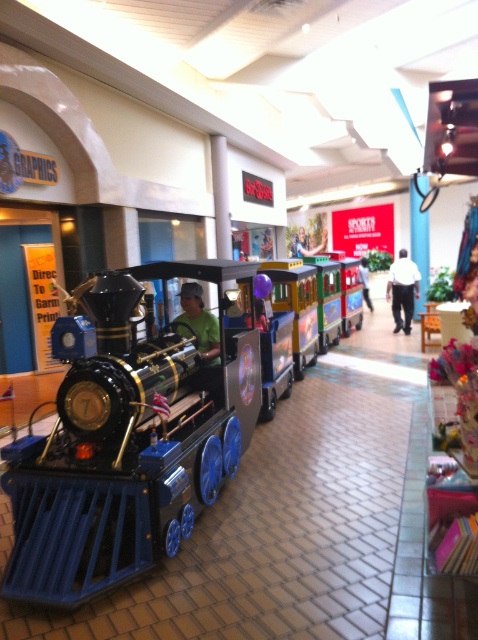
You are standing in the shopping mall and want to take a photo of the train and the child inside it. If you move forward 5 feet, will the point at coordinates point (52, 560) be closer to you?

The point at coordinates point (52, 560) is currently 9.83 feet away. If you move forward 5 feet, it will be 4.83 feet away, so yes, it will be closer to you.

You are standing in the shopping mall and see the shiny black locomotive at left and the green fabric person at center. Which object is positioned further to the left side of the scene?

The shiny black locomotive at left is positioned further to the left side of the scene compared to the green fabric person at center, as it is located to the left of them.